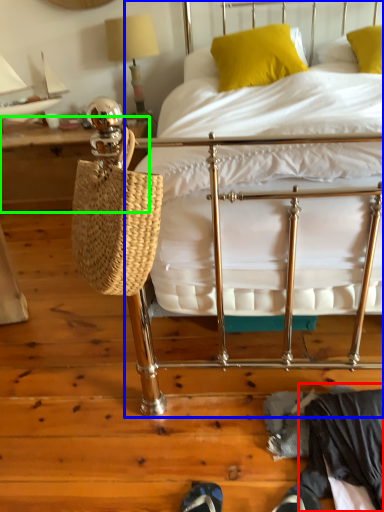
Question: Which object is the closest to the clothing (highlighted by a red box)? Choose among these: bed (highlighted by a blue box) or table (highlighted by a green box).

Choices:
 (A) bed
 (B) table

Answer: (A)